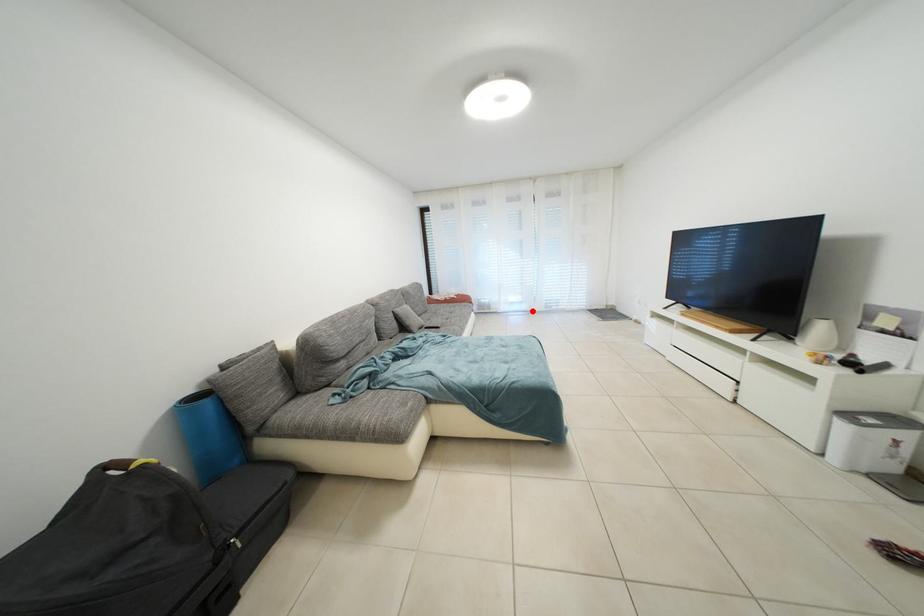
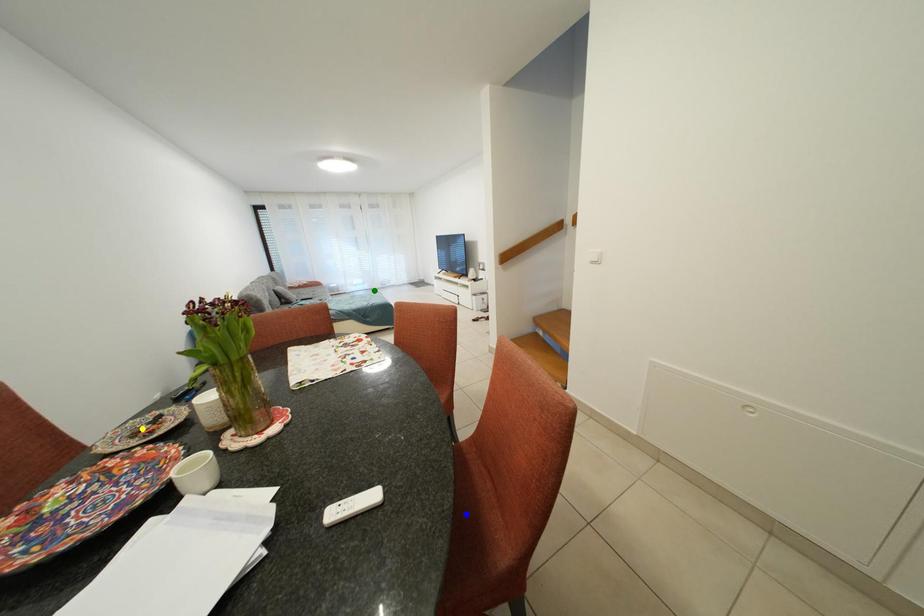
Question: I am providing you with two images of the same scene from different viewpoints. A red point is marked on the first image. You are given multiple points on the second image. Can you choose the point in image 2 that corresponds to the point in image 1?

Choices:
 (A) yellow point
 (B) blue point
 (C) green point

Answer: (C)